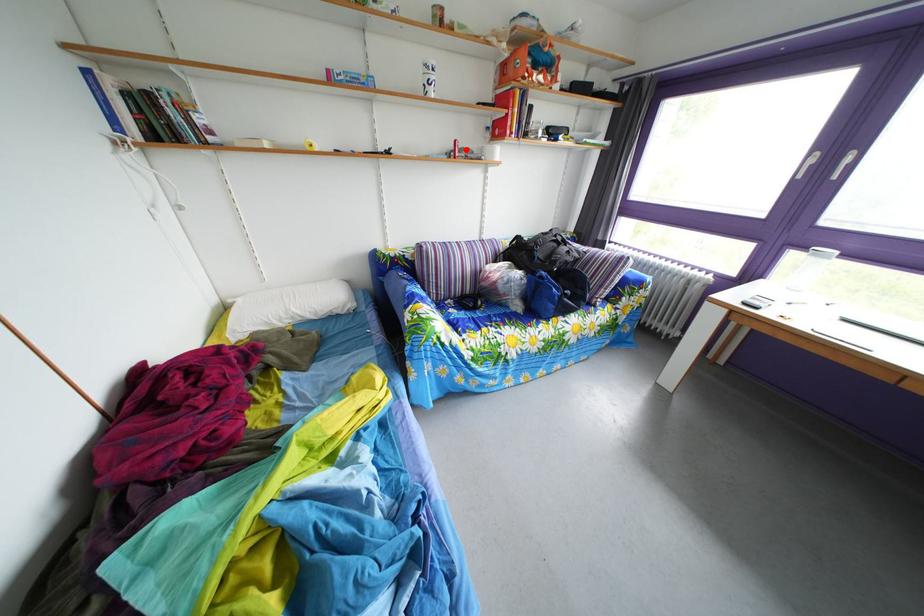
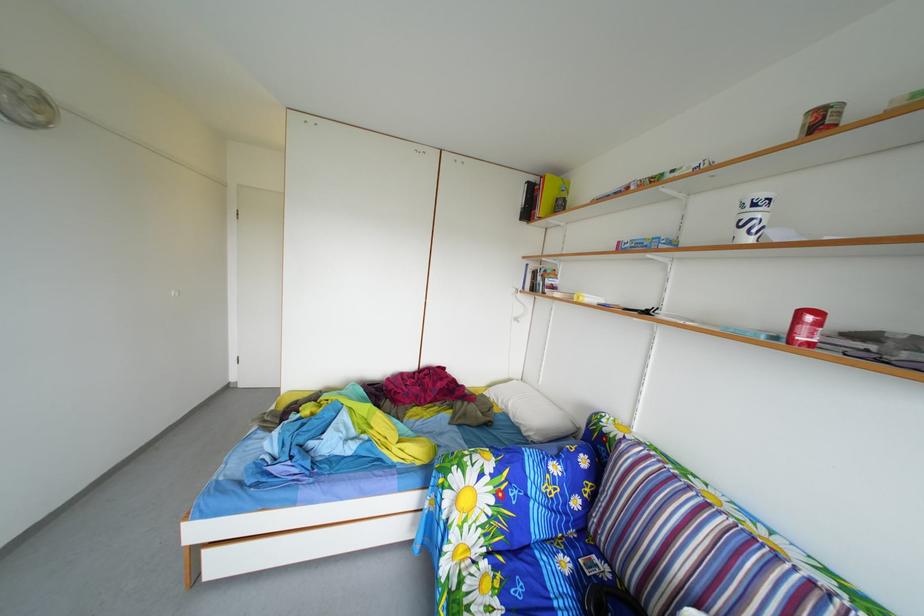
Question: I am providing you with two images of the same scene from different viewpoints. Given a red point in image1, look at the same physical point in image2. Is it:

Choices:
 (A) Closer to the viewpoint
 (B) Farther from the viewpoint

Answer: (B)